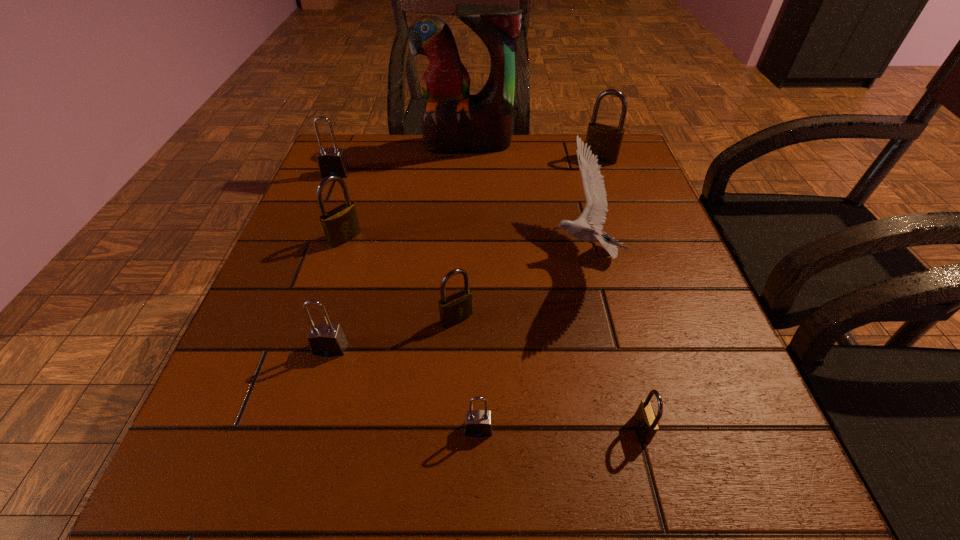
In order to click on padlock identified as the sixth closest to the white gull in this screenshot , I will do `click(340, 225)`.

Locate an element on the screen. brass padlock that is the closest to the rightmost padlock is located at coordinates (455, 308).

Identify which brass padlock is located as the third nearest to the third brass padlock from left to right. Please provide its 2D coordinates. Your answer should be formatted as a tuple, i.e. [(x, y)], where the tuple contains the x and y coordinates of a point satisfying the conditions above.

[(605, 140)]

Identify which gray padlock is the closest to the gull. Please provide its 2D coordinates. Your answer should be formatted as a tuple, i.e. [(x, y)], where the tuple contains the x and y coordinates of a point satisfying the conditions above.

[(478, 423)]

Locate which gray padlock ranks second in proximity to the third brass padlock from left to right. Please provide its 2D coordinates. Your answer should be formatted as a tuple, i.e. [(x, y)], where the tuple contains the x and y coordinates of a point satisfying the conditions above.

[(325, 339)]

Image resolution: width=960 pixels, height=540 pixels. Identify the location of free spot that satisfies the following two spatial constraints: 1. at the tip of the beak of the third brass padlock from left to right; 2. on the left side of the gull. (624, 428).

Where is `blank space that satisfies the following two spatial constraints: 1. at the tip of the beak of the gull; 2. on the shackle of the third nearest padlock`? Image resolution: width=960 pixels, height=540 pixels. blank space that satisfies the following two spatial constraints: 1. at the tip of the beak of the gull; 2. on the shackle of the third nearest padlock is located at coordinates pos(605,348).